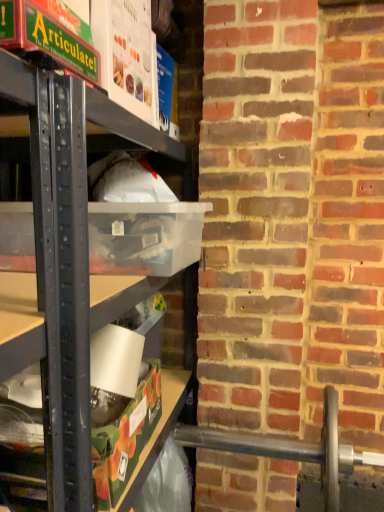
Describe the element at coordinates (74, 270) in the screenshot. This screenshot has width=384, height=512. I see `clear plastic container at upper left` at that location.

Locate an element on the screen. clear plastic container at upper left is located at coordinates (74, 270).

Find the location of a particular element. The height and width of the screenshot is (512, 384). clear plastic container at upper left is located at coordinates (74, 270).